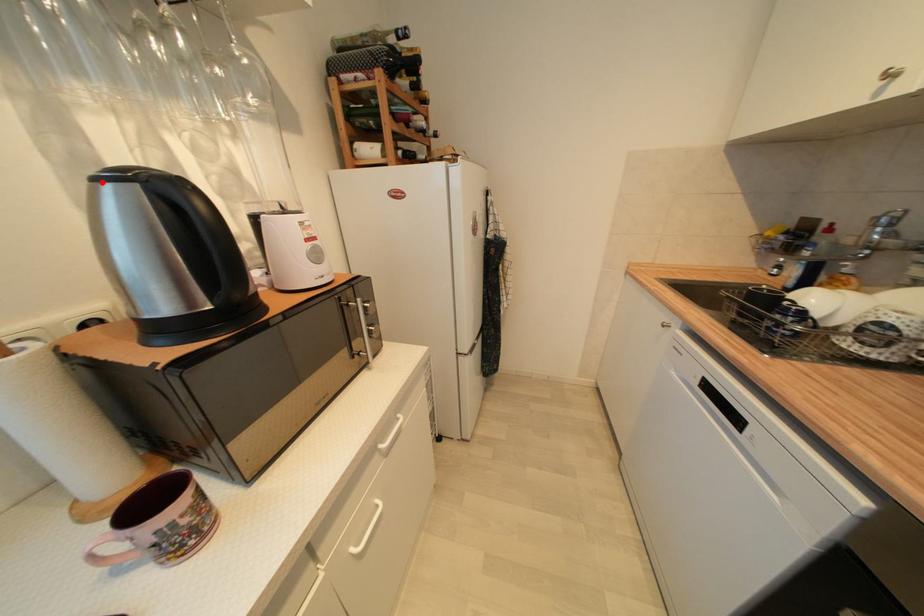
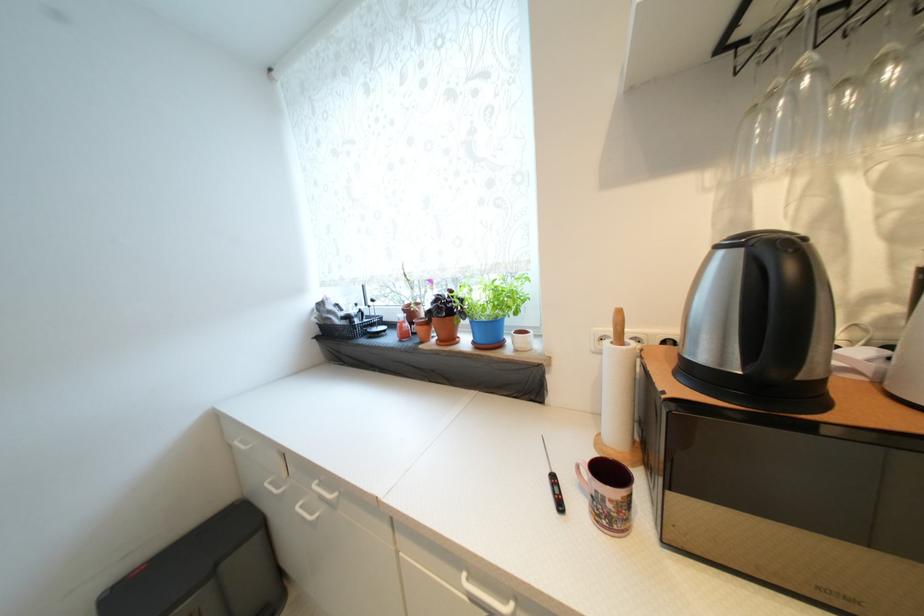
Find the pixel in the second image that matches the highlighted location in the first image.

(723, 249)